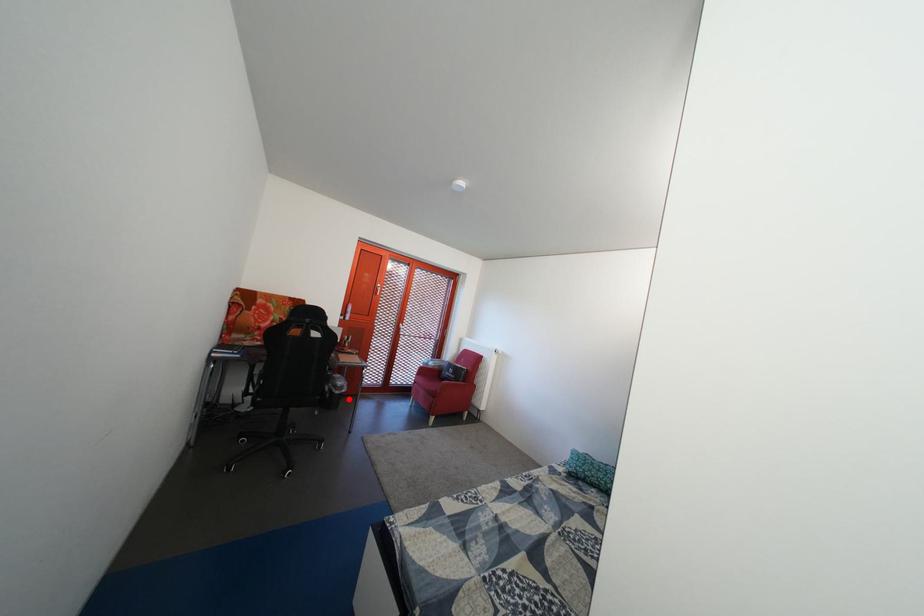
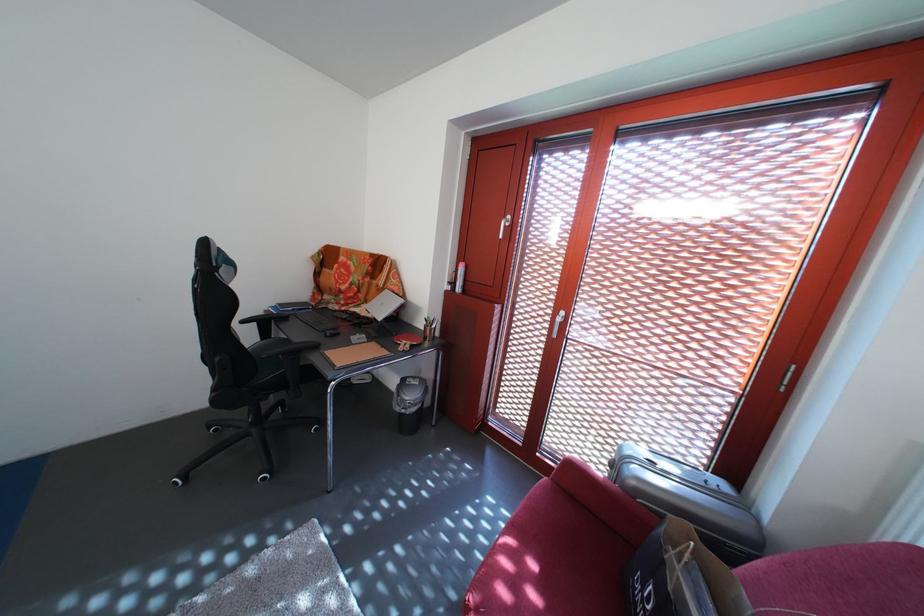
Locate, in the second image, the point that corresponds to the highlighted location in the first image.

(408, 416)